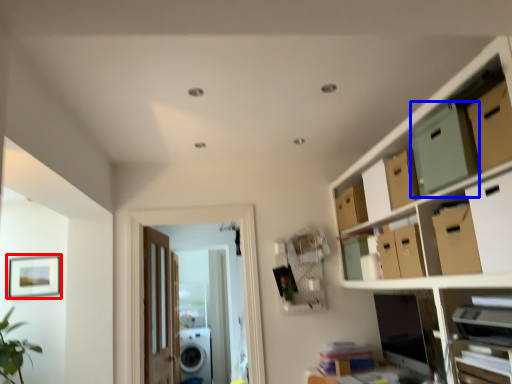
Question: Which object appears closest to the camera in this image, picture frame (highlighted by a red box) or storage box (highlighted by a blue box)?

Choices:
 (A) picture frame
 (B) storage box

Answer: (B)